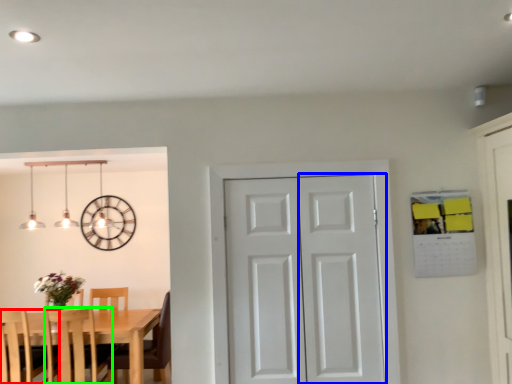
Question: Based on their relative distances, which object is nearer to chair (highlighted by a red box)? Choose from screen door (highlighted by a blue box) and chair (highlighted by a green box).

Choices:
 (A) screen door
 (B) chair

Answer: (B)